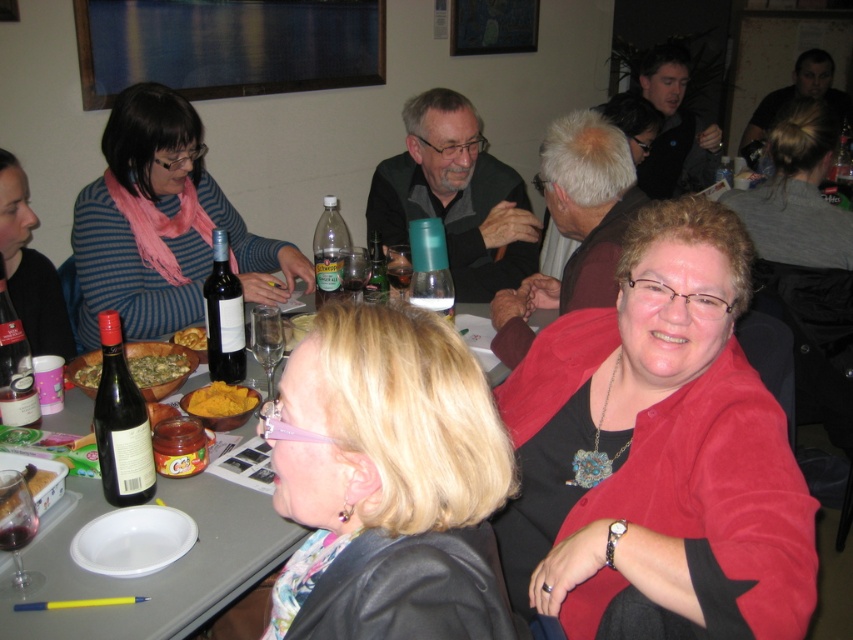
Does matte black sweater at upper left lie in front of green leafymaterial/texturevegetable at table?

No.

Locate an element on the screen. matte black sweater at upper left is located at coordinates (28, 268).

Between point (10, 184) and point (155, 362), which one is positioned in front?

Positioned in front is point (155, 362).

Where is `matte black sweater at upper left`? The height and width of the screenshot is (640, 853). matte black sweater at upper left is located at coordinates (28, 268).

Is red velvet sweater at lower right to the left of matte black sweater at upper left from the viewer's perspective?

No, red velvet sweater at lower right is not to the left of matte black sweater at upper left.

Can you confirm if red velvet sweater at lower right is positioned below matte black sweater at upper left?

Yes.

Between point (691, 598) and point (41, 330), which one is positioned behind?

The point (41, 330) is behind.

Identify the location of red velvet sweater at lower right. (659, 449).

Between blonde hair at center and yellow matte bowl at lower left, which one appears on the right side from the viewer's perspective?

From the viewer's perspective, blonde hair at center appears more on the right side.

What do you see at coordinates (387, 477) in the screenshot?
I see `blonde hair at center` at bounding box center [387, 477].

Locate an element on the screen. The height and width of the screenshot is (640, 853). blonde hair at center is located at coordinates (387, 477).